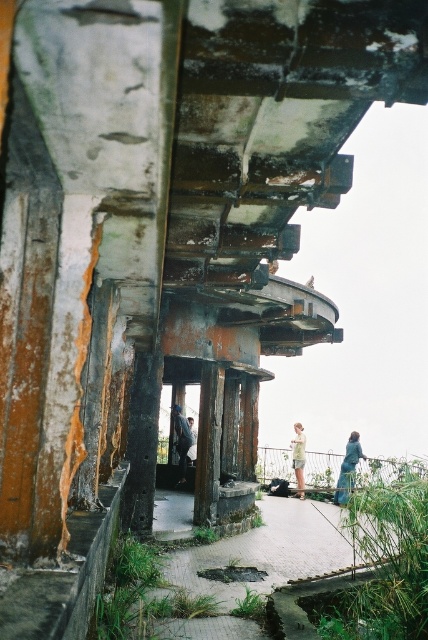
Question: Which object is closer to the camera taking this photo?

Choices:
 (A) light blue denim jeans at center
 (B) dark gray concrete pillar at center

Answer: (B)

Question: Can you confirm if paved stone path at center is thinner than light blue denim jeans at center?

Choices:
 (A) no
 (B) yes

Answer: (B)

Question: Can you confirm if paved stone path at center is bigger than dark gray concrete pillar at center?

Choices:
 (A) no
 (B) yes

Answer: (B)

Question: Estimate the real-world distances between objects in this image. Which object is farther from the paved stone path at center?

Choices:
 (A) light blue denim jeans at center
 (B) dark gray concrete pillar at center
 (C) blue denim jacket at lower right

Answer: (A)

Question: Does blue denim jacket at lower right appear on the right side of light blue denim jeans at center?

Choices:
 (A) no
 (B) yes

Answer: (A)

Question: Which object is closer to the camera taking this photo?

Choices:
 (A) dark gray concrete pillar at center
 (B) blue denim jacket at lower right

Answer: (A)